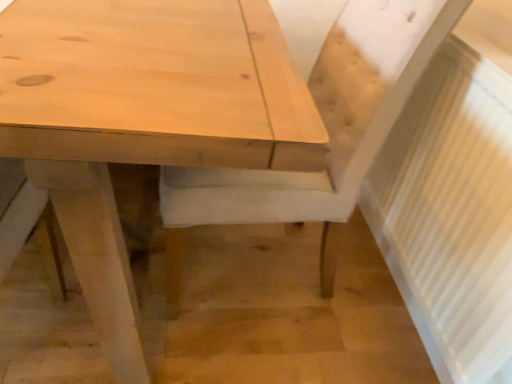
Describe the element at coordinates (327, 129) in the screenshot. I see `natural wood chair at center` at that location.

Where is `natural wood table at center`? natural wood table at center is located at coordinates (143, 119).

Is white textured radiator at right closer to camera compared to natural wood table at center?

No, it is not.

Is white textured radiator at right taller than natural wood table at center?

In fact, white textured radiator at right may be shorter than natural wood table at center.

Looking at this image, from the image's perspective, does white textured radiator at right appear higher than natural wood table at center?

Incorrect, from the image's perspective, white textured radiator at right is lower than natural wood table at center.

From the image's perspective, is natural wood table at center positioned above or below white textured radiator at right?

natural wood table at center is above white textured radiator at right.

Which object is positioned more to the left, natural wood table at center or white textured radiator at right?

natural wood table at center is more to the left.

Relative to white textured radiator at right, is natural wood table at center in front or behind?

Visually, natural wood table at center is located in front of white textured radiator at right.

Based on the photo, is natural wood table at center not close to white textured radiator at right?

No, natural wood table at center is not far from white textured radiator at right.

Which of these two, natural wood chair at center or natural wood table at center, is thinner?

natural wood chair at center is thinner.

Is natural wood chair at center to the left or to the right of natural wood table at center in the image?

From the image, it's evident that natural wood chair at center is to the right of natural wood table at center.

Is natural wood chair at center further to camera compared to natural wood table at center?

That is True.

From a real-world perspective, is natural wood chair at center over white textured radiator at right?

Incorrect, from a real-world perspective, natural wood chair at center is lower than white textured radiator at right.

Is natural wood chair at center inside the boundaries of white textured radiator at right, or outside?

natural wood chair at center is not enclosed by white textured radiator at right.

Between natural wood chair at center and white textured radiator at right, which one is positioned behind?

natural wood chair at center is further from the camera.

Can you confirm if natural wood chair at center is shorter than white textured radiator at right?

Incorrect, the height of natural wood chair at center does not fall short of that of white textured radiator at right.

From a real-world perspective, who is located lower, white textured radiator at right or natural wood chair at center?

natural wood chair at center, from a real-world perspective.

The width and height of the screenshot is (512, 384). In order to click on chair that appears behind the white textured radiator at right in this screenshot , I will do `click(327, 129)`.

Is white textured radiator at right beside natural wood chair at center?

white textured radiator at right and natural wood chair at center are not in contact.

From the image's perspective, is natural wood table at center over natural wood chair at center?

Actually, natural wood table at center appears below natural wood chair at center in the image.

In the scene shown: From a real-world perspective, is natural wood table at center located beneath natural wood chair at center?

Yes, from a real-world perspective, natural wood table at center is beneath natural wood chair at center.

Is natural wood table at center taller than natural wood chair at center?

Incorrect, the height of natural wood table at center is not larger of that of natural wood chair at center.

Is natural wood chair at center at the back of natural wood table at center?

natural wood table at center is not turned away from natural wood chair at center.

Identify the location of table below the white textured radiator at right (from a real-world perspective). This screenshot has width=512, height=384. (143, 119).

Where is `radiator above the natural wood table at center (from a real-world perspective)`? The height and width of the screenshot is (384, 512). radiator above the natural wood table at center (from a real-world perspective) is located at coordinates (451, 212).

Considering their positions, is white textured radiator at right positioned closer to natural wood table at center than natural wood chair at center?

natural wood chair at center is closer to natural wood table at center.

When comparing their distances from white textured radiator at right, does natural wood table at center or natural wood chair at center seem closer?

The object closer to white textured radiator at right is natural wood chair at center.

Which object lies further to the anchor point white textured radiator at right, natural wood chair at center or natural wood table at center?

natural wood table at center is positioned further to the anchor white textured radiator at right.

Looking at the image, which one is located closer to natural wood chair at center, natural wood table at center or white textured radiator at right?

white textured radiator at right.

Which object lies further to the anchor point natural wood table at center, natural wood chair at center or white textured radiator at right?

white textured radiator at right is positioned further to the anchor natural wood table at center.

Looking at the image, which one is located closer to natural wood chair at center, white textured radiator at right or natural wood table at center?

white textured radiator at right.

Find the location of a particular element. The image size is (512, 384). chair located between natural wood table at center and white textured radiator at right in the left-right direction is located at coordinates point(327,129).